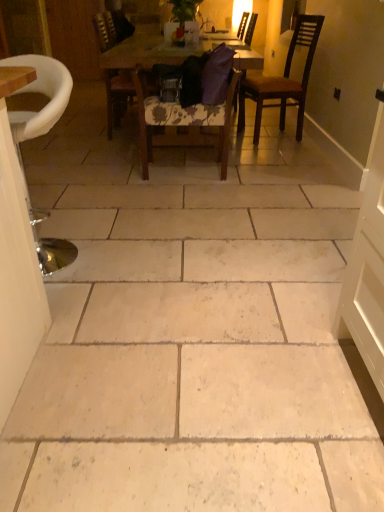
This screenshot has width=384, height=512. In order to click on vacant area that lies in front of wooden table at center in this screenshot , I will do `click(210, 201)`.